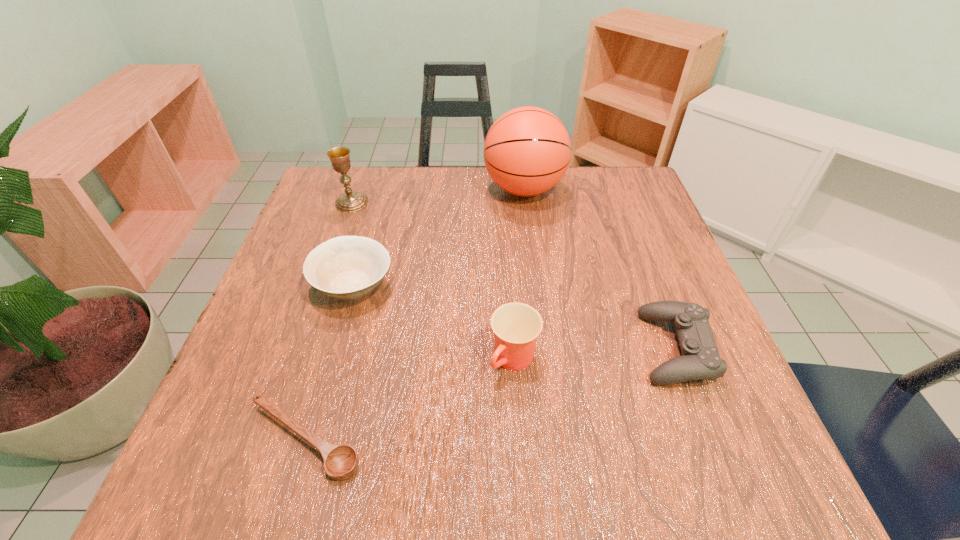
The image size is (960, 540). I want to click on object present at the right edge, so click(x=700, y=360).

The height and width of the screenshot is (540, 960). What are the coordinates of `object that is at the far left corner` in the screenshot? It's located at (350, 202).

Where is `object that is at the near left corner`? object that is at the near left corner is located at coordinates (341, 462).

I want to click on vacant space at the far edge of the desktop, so click(x=494, y=201).

Identify the location of vacant point at the left edge. This screenshot has width=960, height=540. (300, 388).

In the image, there is a desktop. Identify the location of vacant space at the right edge. (626, 287).

Where is `blank space at the far left corner of the desktop`? blank space at the far left corner of the desktop is located at coordinates (374, 201).

Where is `free space at the near left corner of the desktop`? free space at the near left corner of the desktop is located at coordinates (287, 438).

The height and width of the screenshot is (540, 960). In the image, there is a desktop. Identify the location of vacant space at the far right corner. (588, 177).

The image size is (960, 540). I want to click on vacant space at the near right corner of the desktop, so click(x=756, y=435).